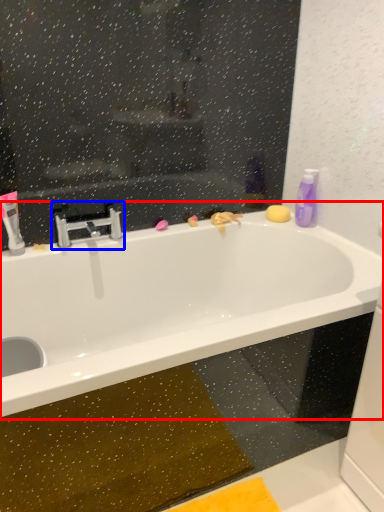
Question: Which point is closer to the camera, bathtub (highlighted by a red box) or tap (highlighted by a blue box)?

Choices:
 (A) bathtub
 (B) tap

Answer: (A)